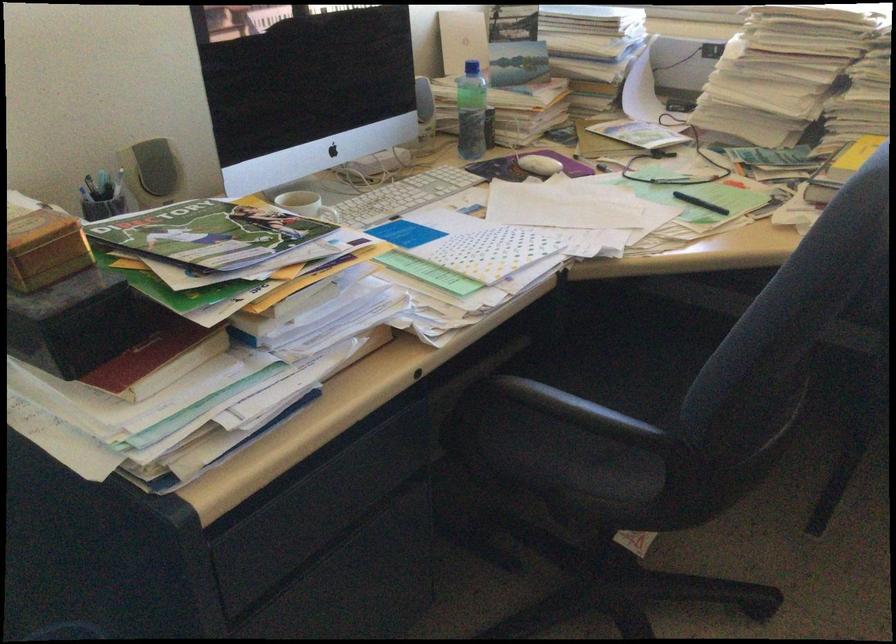
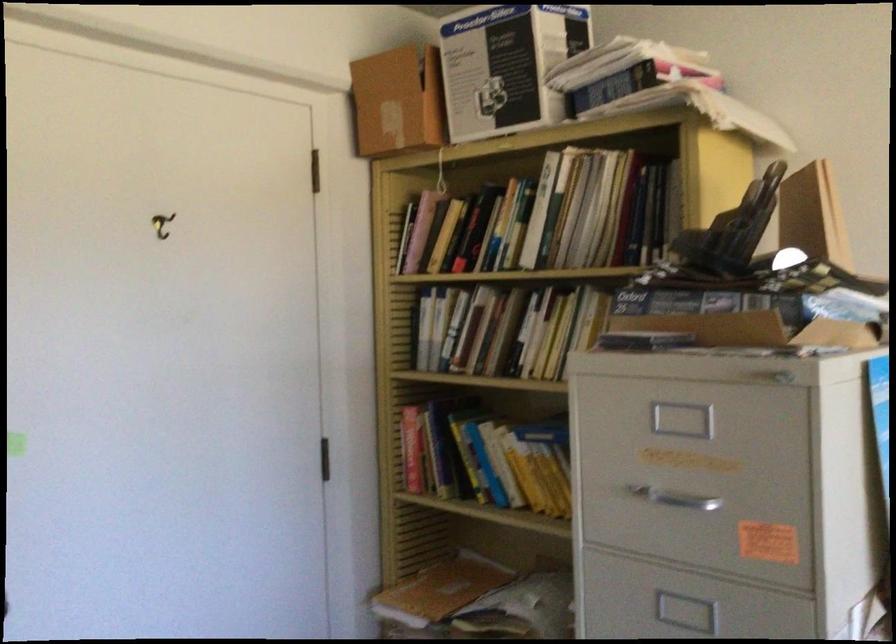
Question: Based on the continuous images, in which direction is the camera rotating? Reply with the corresponding letter.

Choices:
 (A) Left
 (B) Right
 (C) Up
 (D) Down

Answer: (A)